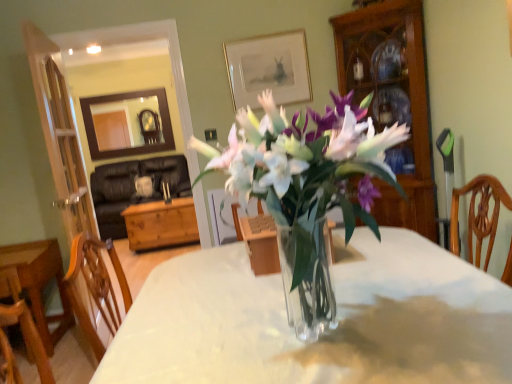
Consider the image. In order to face wooden cabinet at right, should I rotate leftwards or rightwards?

You should rotate right by 16.999 degrees.

What are the coordinates of `clear glass vase at center` in the screenshot? It's located at (306, 187).

What do you see at coordinates (324, 336) in the screenshot? The height and width of the screenshot is (384, 512). I see `transparent glass vase at center` at bounding box center [324, 336].

Locate an element on the screen. Image resolution: width=512 pixels, height=384 pixels. gold-framed picture at upper center is located at coordinates (269, 68).

Describe the element at coordinates (269, 68) in the screenshot. This screenshot has height=384, width=512. I see `gold-framed picture at upper center` at that location.

The image size is (512, 384). What are the coordinates of `wooden cabinet at right` in the screenshot? It's located at (393, 101).

Based on the photo, from a real-world perspective, is clear glass vase at center above or below gold-framed picture at upper center?

From a real-world perspective, clear glass vase at center is physically below gold-framed picture at upper center.

Identify the location of houseplant below the gold-framed picture at upper center (from the image's perspective). (306, 187).

From the picture: Is clear glass vase at center wider or thinner than gold-framed picture at upper center?

clear glass vase at center is wider than gold-framed picture at upper center.

Is clear glass vase at center positioned far away from gold-framed picture at upper center?

Absolutely, clear glass vase at center is distant from gold-framed picture at upper center.

What's the angular difference between clear glass vase at center and wooden table at lower left, which appears as the first table when viewed from the front,'s facing directions?

The facing directions of clear glass vase at center and wooden table at lower left, which appears as the first table when viewed from the front, are 88.6 degrees apart.

Looking at this image, is clear glass vase at center taller or shorter than wooden table at lower left, which appears as the first table when viewed from the front?

Considering their sizes, clear glass vase at center has less height than wooden table at lower left, which appears as the first table when viewed from the front.

Is clear glass vase at center facing towards wooden table at lower left, the second table from the back?

No, clear glass vase at center is not oriented towards wooden table at lower left, the second table from the back.

Which of these two, clear glass vase at center or wooden table at lower left, the second table from the back, is wider?

clear glass vase at center.

Is clear glass vase at center to the left or to the right of wooden cabinet at right in the image?

Clearly, clear glass vase at center is on the left of wooden cabinet at right in the image.

Which object is closer to the camera taking this photo, clear glass vase at center or wooden cabinet at right?

clear glass vase at center is more forward.

Between clear glass vase at center and wooden cabinet at right, which one has more height?

wooden cabinet at right.

In terms of width, does gold-framed picture at upper center look wider or thinner when compared to wooden cabinet at right?

Clearly, gold-framed picture at upper center has less width compared to wooden cabinet at right.

The width and height of the screenshot is (512, 384). Find the location of `picture frame above the wooden cabinet at right (from a real-world perspective)`. picture frame above the wooden cabinet at right (from a real-world perspective) is located at coordinates (269, 68).

Is gold-framed picture at upper center shorter than wooden cabinet at right?

Yes, gold-framed picture at upper center is shorter than wooden cabinet at right.

From the image's perspective, is gold-framed picture at upper center on top of wooden cabinet at right?

Yes, from the image's perspective, gold-framed picture at upper center is on top of wooden cabinet at right.

Is clear glass vase at center located within wooden cabinet at right?

No, clear glass vase at center is not surrounded by wooden cabinet at right.

Which object is closer to the camera taking this photo, wooden cabinet at right or clear glass vase at center?

clear glass vase at center is in front.

Where is `cabinetry on the right of the clear glass vase at center`? Image resolution: width=512 pixels, height=384 pixels. cabinetry on the right of the clear glass vase at center is located at coordinates (393, 101).

Which object is thinner, wooden cabinet at right or clear glass vase at center?

Thinner between the two is wooden cabinet at right.

Does wooden cabinet at right come behind gold-framed picture at upper center?

No, the depth of wooden cabinet at right is less than that of gold-framed picture at upper center.

Who is bigger, wooden cabinet at right or gold-framed picture at upper center?

Bigger between the two is wooden cabinet at right.

Could you tell me if wooden cabinet at right is facing gold-framed picture at upper center?

No, wooden cabinet at right is not aimed at gold-framed picture at upper center.

Based on the photo, which object is positioned more to the right, wooden cabinet at right or gold-framed picture at upper center?

From the viewer's perspective, wooden cabinet at right appears more on the right side.

Can we say gold-framed picture at upper center lies outside transparent glass vase at center?

Yes, gold-framed picture at upper center is outside of transparent glass vase at center.

Is gold-framed picture at upper center next to transparent glass vase at center?

No, gold-framed picture at upper center is not with transparent glass vase at center.

Does gold-framed picture at upper center have a greater height compared to transparent glass vase at center?

In fact, gold-framed picture at upper center may be shorter than transparent glass vase at center.

Looking at the image, does gold-framed picture at upper center seem bigger or smaller compared to transparent glass vase at center?

Clearly, gold-framed picture at upper center is smaller in size than transparent glass vase at center.

This screenshot has height=384, width=512. In order to click on houseplant lying on the right of gold-framed picture at upper center in this screenshot , I will do `click(306, 187)`.

The height and width of the screenshot is (384, 512). There is a clear glass vase at center. Find the location of `the 2nd table below it (from the image's perspective)`. the 2nd table below it (from the image's perspective) is located at coordinates (40, 283).

Which object lies nearer to the anchor point transparent glass vase at center, wooden cabinet at right or wooden table at lower left, the second table from the back?

The object closer to transparent glass vase at center is wooden cabinet at right.

Estimate the real-world distances between objects in this image. Which object is closer to gold-framed picture at upper center, wooden table at lower left, which appears as the first table when viewed from the front, or wooden cabinet at right?

The object closer to gold-framed picture at upper center is wooden cabinet at right.

Considering their positions, is gold-framed picture at upper center positioned further to transparent glass vase at center than wooden cabinet at right?

gold-framed picture at upper center is positioned further to the anchor transparent glass vase at center.

From the image, which object appears to be nearer to gold-framed picture at upper center, transparent glass vase at center or clear glass vase at center?

Based on the image, transparent glass vase at center appears to be nearer to gold-framed picture at upper center.

When comparing their distances from transparent glass vase at center, does gold-framed picture at upper center or wooden table at lower left, which appears as the first table when viewed from the front, seem closer?

Among the two, gold-framed picture at upper center is located nearer to transparent glass vase at center.

When comparing their distances from wooden table at lower left, the second table from the back, does wooden cabinet at right or clear glass vase at center seem closer?

clear glass vase at center is positioned closer to the anchor wooden table at lower left, the second table from the back.

Based on their spatial positions, is wooden chest at center, which ranks as the 1th table in back-to-front order, or clear glass vase at center closer to transparent glass vase at center?

clear glass vase at center.

Estimate the real-world distances between objects in this image. Which object is further from wooden chest at center, which ranks as the 1th table in back-to-front order, transparent glass vase at center or gold-framed picture at upper center?

The object further to wooden chest at center, which ranks as the 1th table in back-to-front order, is transparent glass vase at center.

You are a GUI agent. You are given a task and a screenshot of the screen. Output one action in this format:
    pyautogui.click(x=<x>, y=<y>)
    Task: Click on the table between clear glass vase at center and gold-framed picture at upper center along the z-axis
    Image resolution: width=512 pixels, height=384 pixels.
    Given the screenshot: What is the action you would take?
    pyautogui.click(x=40, y=283)

You are a GUI agent. You are given a task and a screenshot of the screen. Output one action in this format:
    pyautogui.click(x=<x>, y=<y>)
    Task: Click on the picture frame between clear glass vase at center and wooden chest at center, which ranks as the 1th table in back-to-front order, in the front-back direction
    The image size is (512, 384).
    Given the screenshot: What is the action you would take?
    pyautogui.click(x=269, y=68)

Where is `picture frame positioned between transparent glass vase at center and wooden chest at center, which ranks as the 1th table in back-to-front order, from near to far`? The height and width of the screenshot is (384, 512). picture frame positioned between transparent glass vase at center and wooden chest at center, which ranks as the 1th table in back-to-front order, from near to far is located at coordinates pos(269,68).

Image resolution: width=512 pixels, height=384 pixels. I want to click on desk located between clear glass vase at center and wooden cabinet at right in the depth direction, so click(324, 336).